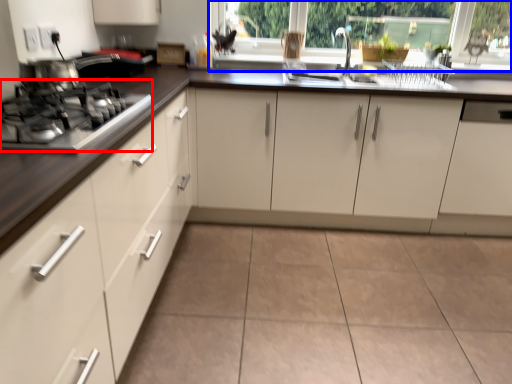
Question: Which object is further to the camera taking this photo, gas stove (highlighted by a red box) or window frame (highlighted by a blue box)?

Choices:
 (A) gas stove
 (B) window frame

Answer: (B)